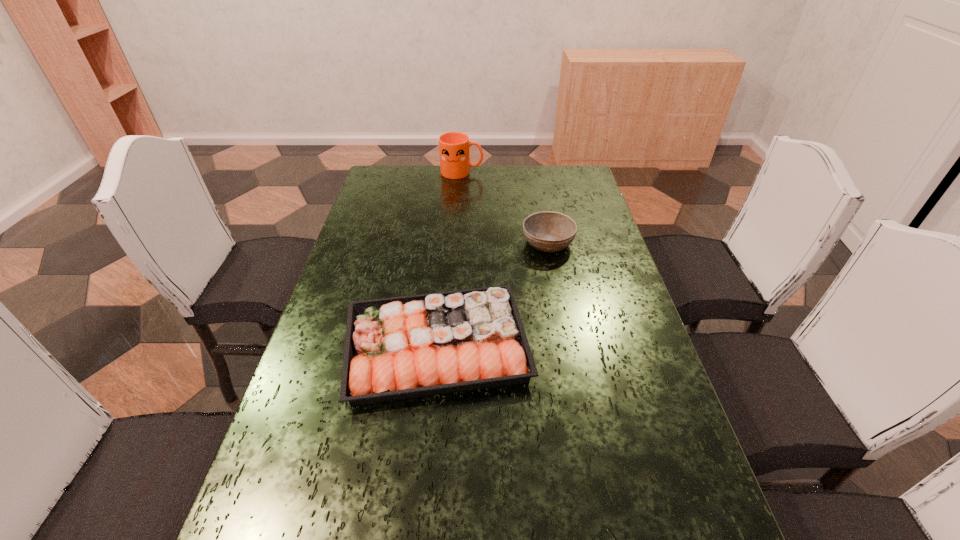
This screenshot has height=540, width=960. Find the location of `vacant area that satisfies the following two spatial constraints: 1. on the handle side of the tallest object; 2. on the front side of the third farthest object`. vacant area that satisfies the following two spatial constraints: 1. on the handle side of the tallest object; 2. on the front side of the third farthest object is located at coordinates (450, 346).